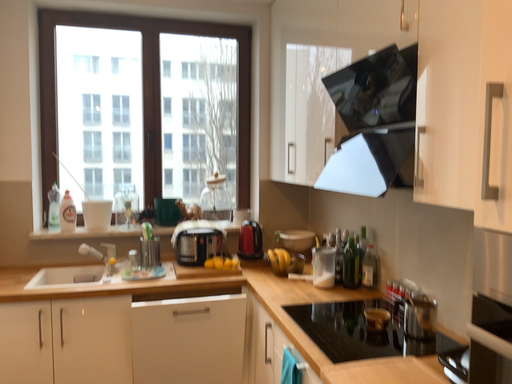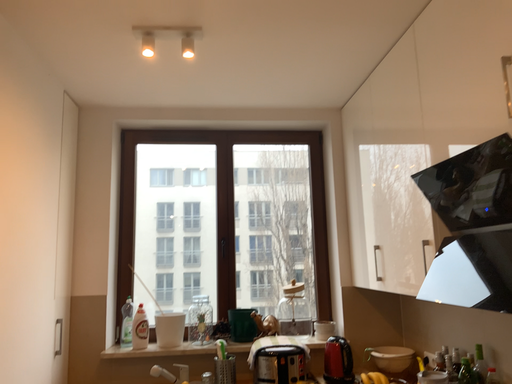
Question: Which way did the camera rotate in the video?

Choices:
 (A) rotated upward
 (B) rotated downward

Answer: (A)